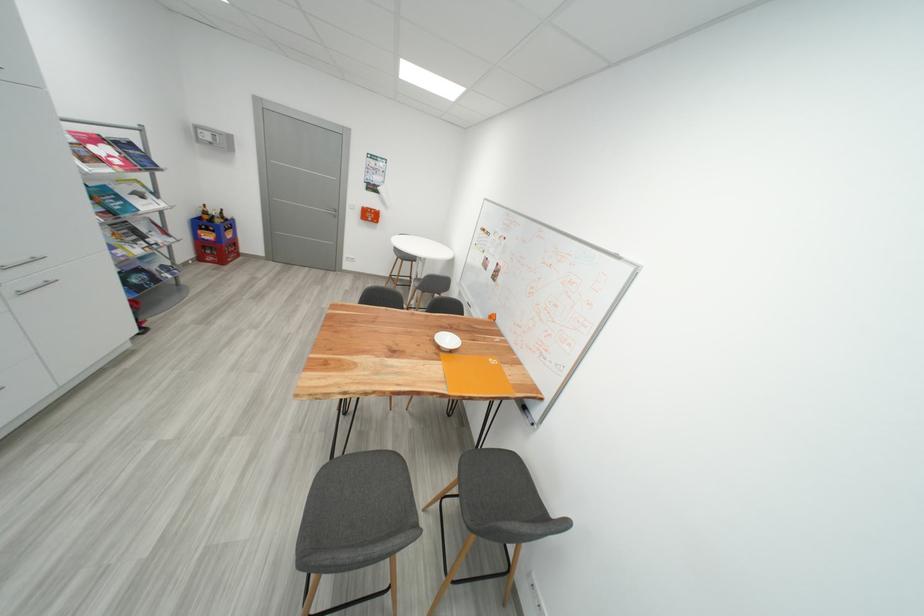
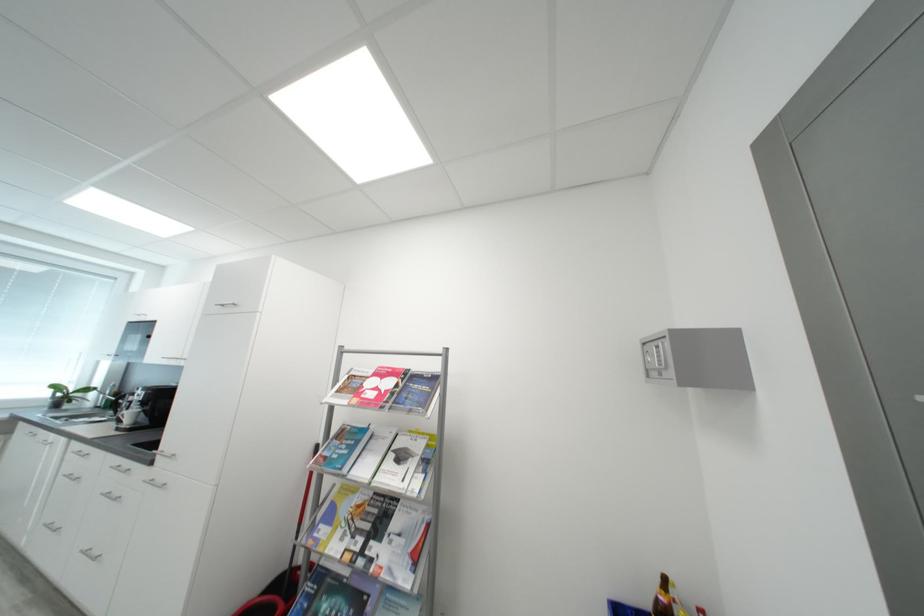
In the second image, find the point that corresponds to point (222, 142) in the first image.

(666, 362)